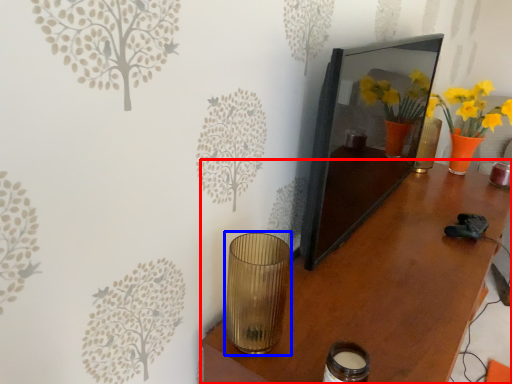
Question: Which point is closer to the camera, table (highlighted by a red box) or candle holder (highlighted by a blue box)?

Choices:
 (A) table
 (B) candle holder

Answer: (A)